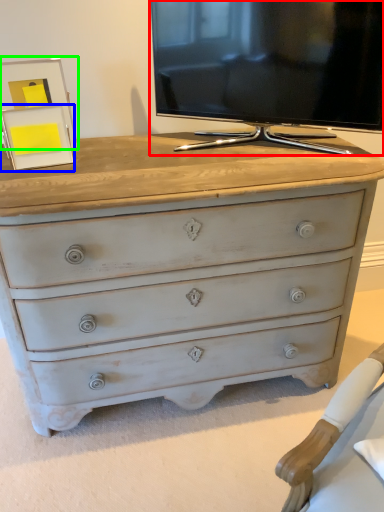
Question: Considering the real-world distances, which object is closest to television (highlighted by a red box)? picture frame (highlighted by a blue box) or picture frame (highlighted by a green box).

Choices:
 (A) picture frame
 (B) picture frame

Answer: (B)